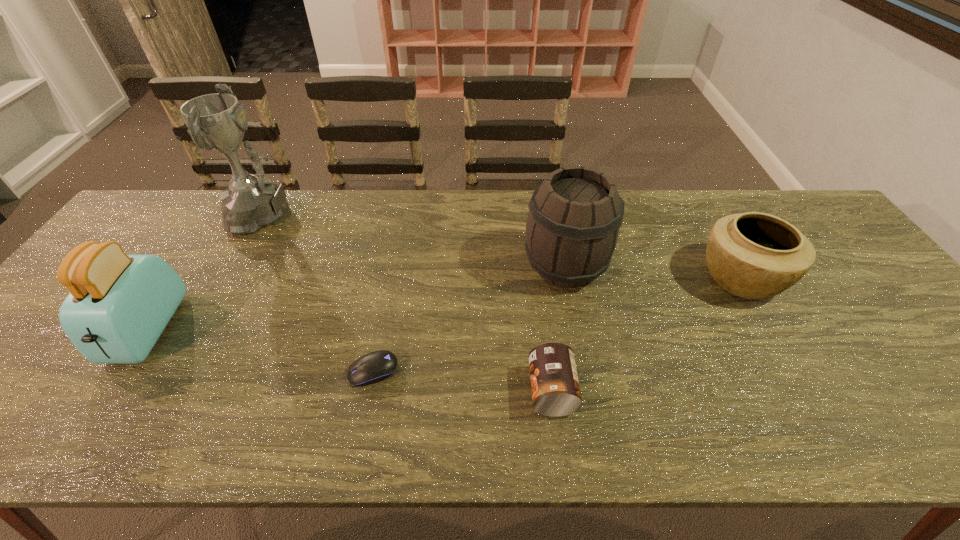
In order to click on vacant region located on the side of the toaster with the lever in this screenshot , I will do `click(98, 406)`.

Find the location of a particular element. vacant point located on the back of the fourth tallest object is located at coordinates (705, 214).

Locate an element on the screen. free space located on the front label of the can is located at coordinates (396, 390).

At what (x,y) coordinates should I click in order to perform the action: click on blank space located on the front label of the can. Please return your answer as a coordinate pair (x, y). This screenshot has height=540, width=960. Looking at the image, I should click on (479, 390).

Where is `vacant area situated 0.350m on the front label of the can`? Image resolution: width=960 pixels, height=540 pixels. vacant area situated 0.350m on the front label of the can is located at coordinates (369, 390).

The image size is (960, 540). I want to click on vacant space located on the right of the computer mouse, so 477,371.

At what (x,y) coordinates should I click in order to perform the action: click on object at the far edge. Please return your answer as a coordinate pair (x, y). The width and height of the screenshot is (960, 540). Looking at the image, I should click on (217, 122).

Identify the location of object at the near edge. (555, 387).

The image size is (960, 540). In the image, there is a desktop. Identify the location of vacant space at the far edge. (370, 219).

Image resolution: width=960 pixels, height=540 pixels. I want to click on vacant space at the near edge, so click(110, 410).